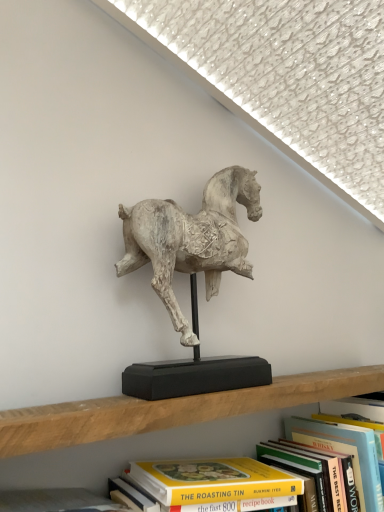
Identify the location of yellow paperback book at center, placed as the first book when sorted from left to right. The width and height of the screenshot is (384, 512). (346, 455).

From a real-world perspective, which object stands above the other?

white textured horse at center.

Can you confirm if hardcover book at upper center, arranged as the 1th book when viewed from the right, is smaller than white textured horse at center?

Yes, hardcover book at upper center, arranged as the 1th book when viewed from the right, is smaller than white textured horse at center.

Looking at this image, from their relative heights in the image, would you say hardcover book at upper center, arranged as the 1th book when viewed from the right, is taller or shorter than white textured horse at center?

Considering their sizes, hardcover book at upper center, arranged as the 1th book when viewed from the right, has less height than white textured horse at center.

From a real-world perspective, relative to white textured horse at center, is yellow paperback book at center, placed as the first book when sorted from left to right, vertically above or below?

In terms of real-world spatial position, yellow paperback book at center, placed as the first book when sorted from left to right, is below white textured horse at center.

Measure the distance from yellow paperback book at center, placed as the first book when sorted from left to right, to white textured horse at center.

yellow paperback book at center, placed as the first book when sorted from left to right, is 14.42 inches away from white textured horse at center.

Considering the positions of objects yellow paperback book at center, placed as the first book when sorted from left to right, and white textured horse at center in the image provided, who is behind, yellow paperback book at center, placed as the first book when sorted from left to right, or white textured horse at center?

white textured horse at center is more distant.

Does yellow paperback book at center, placed as the first book when sorted from left to right, have a lesser width compared to white textured horse at center?

Incorrect, the width of yellow paperback book at center, placed as the first book when sorted from left to right, is not less than that of white textured horse at center.

Looking at the image, does white textured horse at center seem bigger or smaller compared to yellow paperback book at center, placed as the first book when sorted from left to right?

white textured horse at center is bigger than yellow paperback book at center, placed as the first book when sorted from left to right.

Is yellow paperback book at center, positioned as the 2th book in right-to-left order, surrounded by white textured horse at center?

No, yellow paperback book at center, positioned as the 2th book in right-to-left order, is not inside white textured horse at center.

Which is in front, white textured horse at center or yellow paperback book at center, positioned as the 2th book in right-to-left order?

yellow paperback book at center, positioned as the 2th book in right-to-left order.

Is white textured horse at center with hardcover book at upper center, the 2th book in the left-to-right sequence?

No, white textured horse at center is not with hardcover book at upper center, the 2th book in the left-to-right sequence.

Which is more to the left, white textured horse at center or hardcover book at upper center, arranged as the 1th book when viewed from the right?

white textured horse at center.

Can you tell me how much white textured horse at center and hardcover book at upper center, arranged as the 1th book when viewed from the right, differ in facing direction?

4.95 degrees.

From the image's perspective, is white textured horse at center located beneath hardcover book at upper center, the 2th book in the left-to-right sequence?

Actually, white textured horse at center appears above hardcover book at upper center, the 2th book in the left-to-right sequence, in the image.

Identify the location of book that is above the hardcover book at upper center, the 2th book in the left-to-right sequence (from a real-world perspective). The image size is (384, 512). (346, 455).

From the image's perspective, which one is positioned lower, yellow paperback book at center, positioned as the 2th book in right-to-left order, or hardcover book at upper center, arranged as the 1th book when viewed from the right?

hardcover book at upper center, arranged as the 1th book when viewed from the right, appears lower in the image.

Does yellow paperback book at center, placed as the first book when sorted from left to right, turn towards hardcover book at upper center, the 2th book in the left-to-right sequence?

No, yellow paperback book at center, placed as the first book when sorted from left to right, is not oriented towards hardcover book at upper center, the 2th book in the left-to-right sequence.

Considering the points (372, 493) and (372, 495), which point is behind, point (372, 493) or point (372, 495)?

The point (372, 495) is more distant.

From the image's perspective, is hardcover book at upper center, arranged as the 1th book when viewed from the right, on yellow paperback book at center, positioned as the 2th book in right-to-left order?

No, from the image's perspective, hardcover book at upper center, arranged as the 1th book when viewed from the right, is not on top of yellow paperback book at center, positioned as the 2th book in right-to-left order.

Is hardcover book at upper center, arranged as the 1th book when viewed from the right, wider than yellow paperback book at center, positioned as the 2th book in right-to-left order?

Correct, the width of hardcover book at upper center, arranged as the 1th book when viewed from the right, exceeds that of yellow paperback book at center, positioned as the 2th book in right-to-left order.

Does hardcover book at upper center, the 2th book in the left-to-right sequence, appear on the left side of yellow paperback book at center, placed as the first book when sorted from left to right?

Incorrect, hardcover book at upper center, the 2th book in the left-to-right sequence, is not on the left side of yellow paperback book at center, placed as the first book when sorted from left to right.

Is hardcover book at upper center, the 2th book in the left-to-right sequence, completely or partially outside of yellow paperback book at center, placed as the first book when sorted from left to right?

Yes.

Where is `book behind the white textured horse at center`? book behind the white textured horse at center is located at coordinates (344, 453).

Identify the location of horse on the left of the yellow paperback book at center, placed as the first book when sorted from left to right. The width and height of the screenshot is (384, 512). (191, 239).

Estimate the real-world distances between objects in this image. Which object is closer to white textured horse at center, hardcover book at upper center, arranged as the 1th book when viewed from the right, or yellow paperback book at center, placed as the first book when sorted from left to right?

yellow paperback book at center, placed as the first book when sorted from left to right.

Considering their positions, is white textured horse at center positioned further to yellow paperback book at center, positioned as the 2th book in right-to-left order, than hardcover book at upper center, arranged as the 1th book when viewed from the right?

The object further to yellow paperback book at center, positioned as the 2th book in right-to-left order, is white textured horse at center.

Based on their spatial positions, is white textured horse at center or yellow paperback book at center, placed as the first book when sorted from left to right, further from hardcover book at upper center, the 2th book in the left-to-right sequence?

Based on the image, white textured horse at center appears to be further to hardcover book at upper center, the 2th book in the left-to-right sequence.

When comparing their distances from white textured horse at center, does yellow paperback book at center, positioned as the 2th book in right-to-left order, or hardcover book at upper center, arranged as the 1th book when viewed from the right, seem closer?

yellow paperback book at center, positioned as the 2th book in right-to-left order, is closer to white textured horse at center.

Looking at the image, which one is located closer to yellow paperback book at center, placed as the first book when sorted from left to right, hardcover book at upper center, arranged as the 1th book when viewed from the right, or white textured horse at center?

The object closer to yellow paperback book at center, placed as the first book when sorted from left to right, is hardcover book at upper center, arranged as the 1th book when viewed from the right.

Based on their spatial positions, is yellow paperback book at center, positioned as the 2th book in right-to-left order, or white textured horse at center closer to hardcover book at upper center, arranged as the 1th book when viewed from the right?

yellow paperback book at center, positioned as the 2th book in right-to-left order, is positioned closer to the anchor hardcover book at upper center, arranged as the 1th book when viewed from the right.

The height and width of the screenshot is (512, 384). I want to click on book between white textured horse at center and hardcover book at upper center, arranged as the 1th book when viewed from the right, vertically, so click(346, 455).